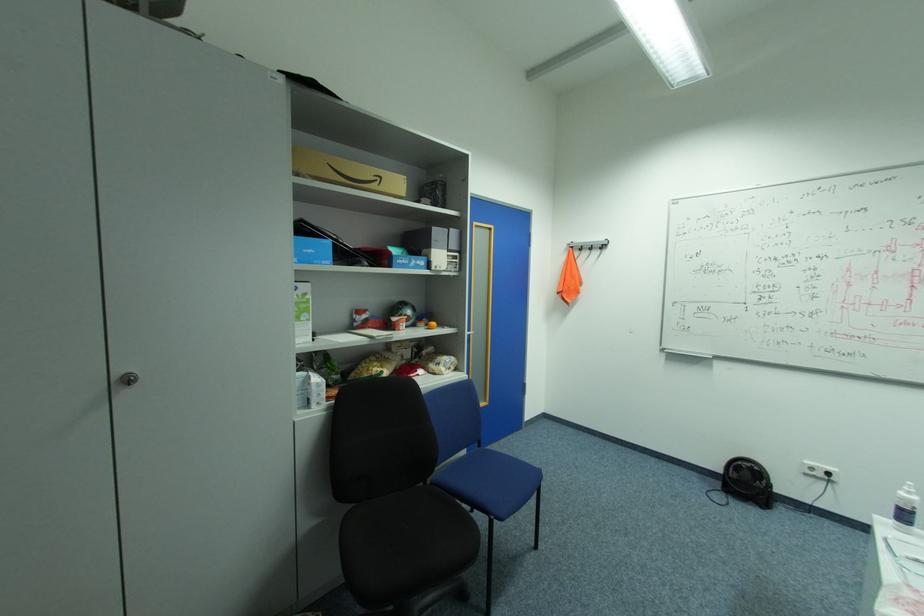
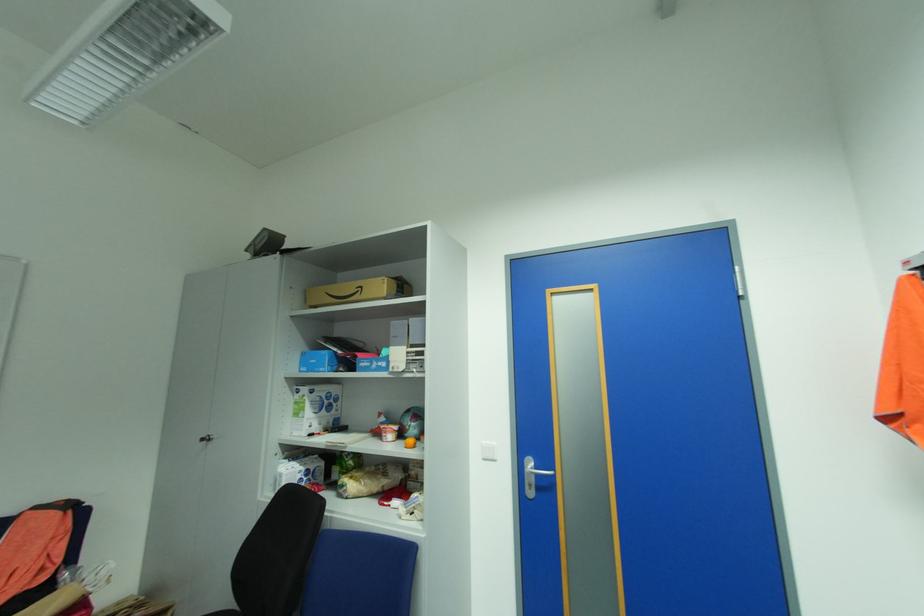
In the second image, find the point that corresponds to (x=386, y=177) in the first image.

(368, 286)